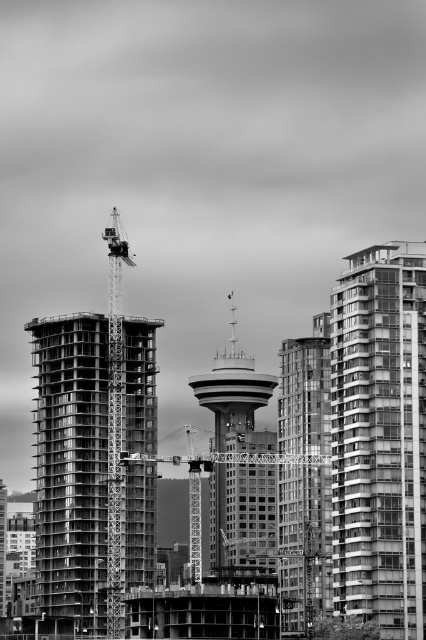
Between concrete construction at center and smooth glass building at center, which one is positioned lower?

smooth glass building at center is below.

Who is more forward, [45,456] or [311,620]?

Point [311,620] is in front.

Find the location of a particular element. This screenshot has height=640, width=426. concrete construction at center is located at coordinates coord(71,465).

Is glassy reflective building at right below concrete construction at center?

No, glassy reflective building at right is not below concrete construction at center.

Is glassy reflective building at right shorter than concrete construction at center?

Correct, glassy reflective building at right is not as tall as concrete construction at center.

I want to click on glassy reflective building at right, so click(x=379, y=438).

Does smooth concrete tower at center appear on the left side of metallic construction crane at center?

In fact, smooth concrete tower at center is to the right of metallic construction crane at center.

Where is `smooth concrete tower at center`? smooth concrete tower at center is located at coordinates (235, 396).

Identify the location of smooth concrete tower at center. The image size is (426, 640). (235, 396).